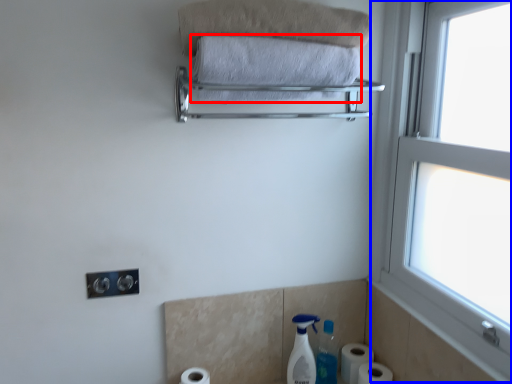
Question: Which object appears closest to the camera in this image, towel (highlighted by a red box) or window (highlighted by a blue box)?

Choices:
 (A) towel
 (B) window

Answer: (B)